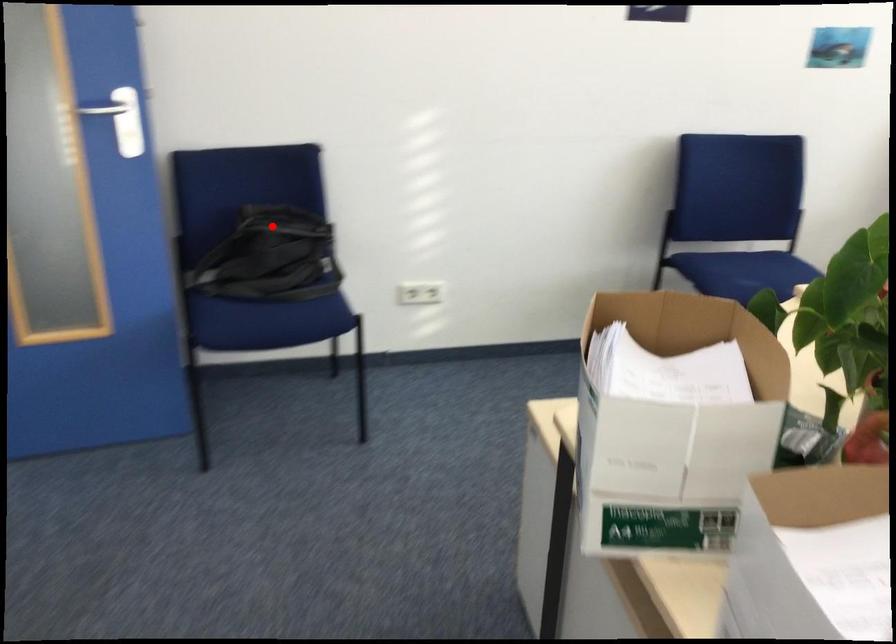
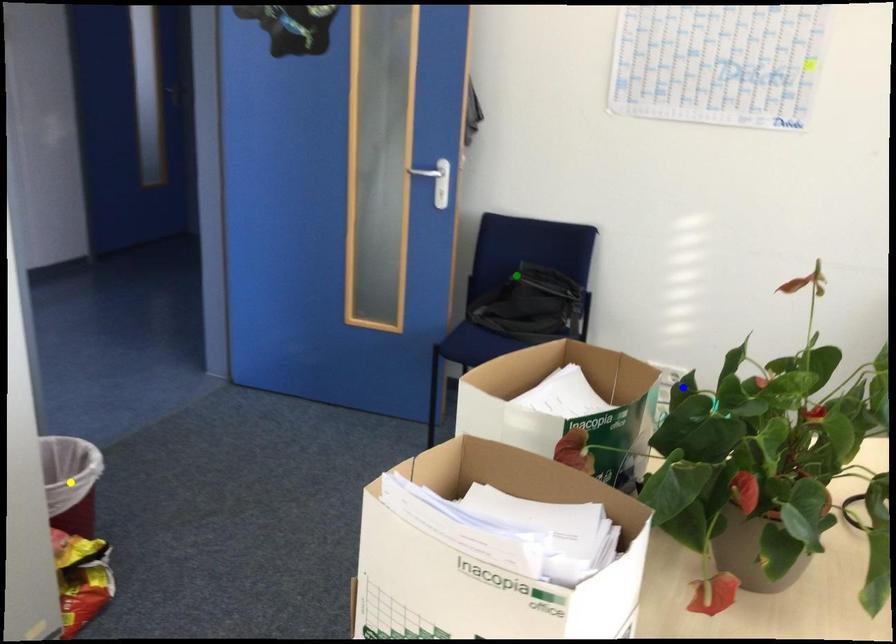
Question: I am providing you with two images of the same scene from different viewpoints. A red point is marked on the first image. You are given multiple points on the second image. Can you choose the point in image 2 that corresponds to the point in image 1?

Choices:
 (A) blue point
 (B) yellow point
 (C) green point

Answer: (C)